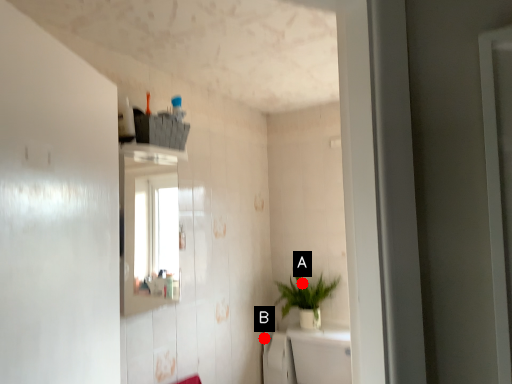
Question: Two points are circled on the image, labeled by A and B beside each circle. Among these points, which one is nearest to the camera?

Choices:
 (A) A is closer
 (B) B is closer

Answer: (B)